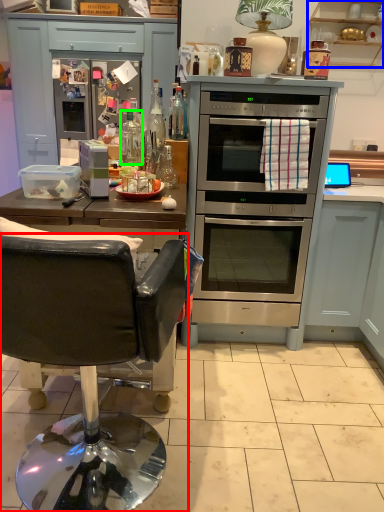
Question: Considering the real-world distances, which object is closest to chair (highlighted by a red box)? cabinetry (highlighted by a blue box) or bottle (highlighted by a green box).

Choices:
 (A) cabinetry
 (B) bottle

Answer: (B)